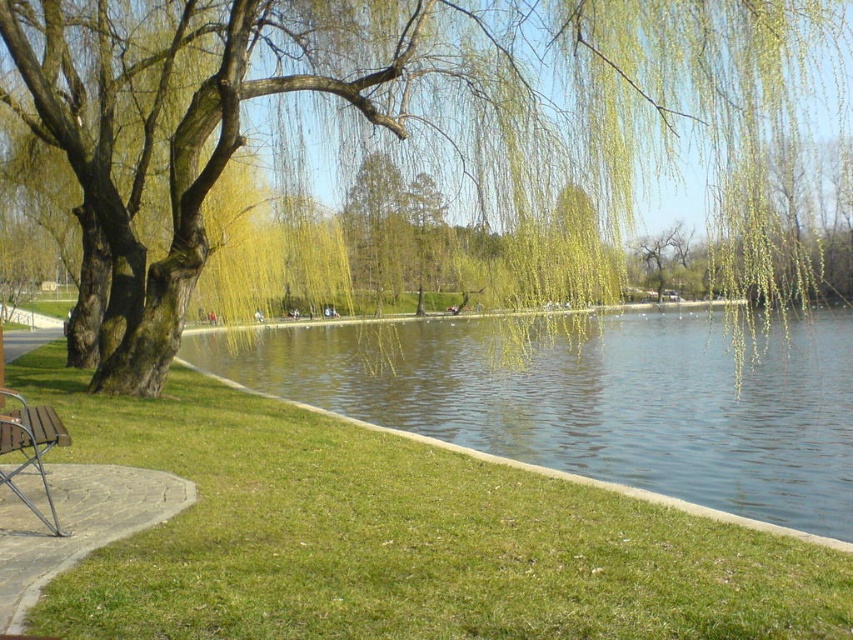
Who is higher up, green leafy willow at upper center or green liquid water at center?

green leafy willow at upper center

Does green leafy willow at upper center lie behind green liquid water at center?

Yes.

Find the location of a particular element. green leafy willow at upper center is located at coordinates [364, 99].

Is green leafy willow at upper center above wooden bench at lower left?

Indeed, green leafy willow at upper center is positioned over wooden bench at lower left.

Is green leafy willow at upper center closer to the viewer compared to wooden bench at lower left?

No.

Is point (428, 40) less distant than point (41, 476)?

No, it is not.

Identify the location of green leafy willow at upper center. The width and height of the screenshot is (853, 640). (364, 99).

Can you confirm if green liquid water at center is wider than wooden bench at lower left?

Indeed, green liquid water at center has a greater width compared to wooden bench at lower left.

Where is `green liquid water at center`? This screenshot has height=640, width=853. green liquid water at center is located at coordinates (595, 396).

You are a GUI agent. You are given a task and a screenshot of the screen. Output one action in this format:
    pyautogui.click(x=<x>, y=<y>)
    Task: Click on the green liquid water at center
    This screenshot has width=853, height=640.
    Given the screenshot: What is the action you would take?
    pyautogui.click(x=595, y=396)